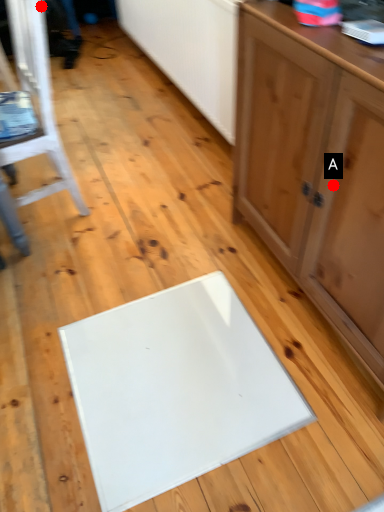
Question: Two points are circled on the image, labeled by A and B beside each circle. Which point appears closest to the camera in this image?

Choices:
 (A) A is closer
 (B) B is closer

Answer: (A)